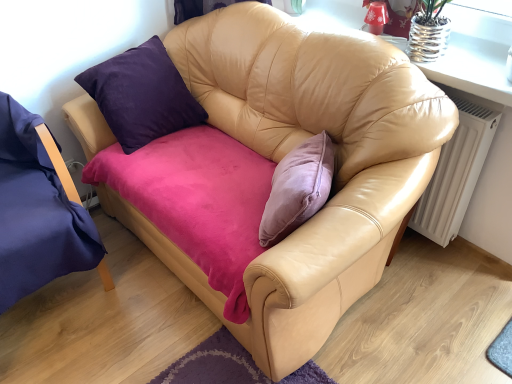
Find the location of a particular element. Image resolution: width=512 pixels, height=384 pixels. white matte radiator at right is located at coordinates (456, 169).

The height and width of the screenshot is (384, 512). What do you see at coordinates (456, 169) in the screenshot?
I see `white matte radiator at right` at bounding box center [456, 169].

What do you see at coordinates (39, 210) in the screenshot? I see `purple fabric chair at left` at bounding box center [39, 210].

Image resolution: width=512 pixels, height=384 pixels. What are the coordinates of `purple fabric chair at left` in the screenshot? It's located at (39, 210).

I want to click on white matte radiator at right, so click(x=456, y=169).

Is purple fabric chair at left at the right side of white matte radiator at right?

No, purple fabric chair at left is not to the right of white matte radiator at right.

Is purple fabric chair at left in front of white matte radiator at right?

That is True.

Which point is more distant from viewer, [34,134] or [492,121]?

The point [34,134] is farther from the camera.

From the image's perspective, which one is positioned higher, purple fabric chair at left or white matte radiator at right?

white matte radiator at right.

From a real-world perspective, is purple fabric chair at left beneath white matte radiator at right?

No.

Which of these two, purple fabric chair at left or white matte radiator at right, is thinner?

With smaller width is white matte radiator at right.

Which of these two, purple fabric chair at left or white matte radiator at right, stands shorter?

With less height is white matte radiator at right.

Can you confirm if purple fabric chair at left is bigger than white matte radiator at right?

Indeed, purple fabric chair at left has a larger size compared to white matte radiator at right.

Is purple fabric chair at left completely or partially outside of white matte radiator at right?

Indeed, purple fabric chair at left is completely outside white matte radiator at right.

Is purple fabric chair at left far away from white matte radiator at right?

Yes.

Is purple fabric chair at left looking in the opposite direction of white matte radiator at right?

No, purple fabric chair at left is not facing away from white matte radiator at right.

How many degrees apart are the facing directions of purple fabric chair at left and white matte radiator at right?

83.6 degrees.

Identify the location of chair that is above the white matte radiator at right (from a real-world perspective). The height and width of the screenshot is (384, 512). point(39,210).

Considering the positions of objects white matte radiator at right and purple fabric chair at left in the image provided, who is more to the right, white matte radiator at right or purple fabric chair at left?

From the viewer's perspective, white matte radiator at right appears more on the right side.

Is white matte radiator at right further to the viewer compared to purple fabric chair at left?

Yes.

Considering the positions of point (473, 125) and point (3, 307), is point (473, 125) closer or farther from the camera than point (3, 307)?

Clearly, point (473, 125) is more distant from the camera than point (3, 307).

From the image's perspective, is white matte radiator at right positioned above or below purple fabric chair at left?

Based on their image positions, white matte radiator at right is located above purple fabric chair at left.

From a real-world perspective, relative to purple fabric chair at left, is white matte radiator at right vertically above or below?

From a real-world perspective, white matte radiator at right is physically below purple fabric chair at left.

Which object is thinner, white matte radiator at right or purple fabric chair at left?

With smaller width is white matte radiator at right.

Considering the relative sizes of white matte radiator at right and purple fabric chair at left in the image provided, is white matte radiator at right shorter than purple fabric chair at left?

Yes, white matte radiator at right is shorter than purple fabric chair at left.

Who is bigger, white matte radiator at right or purple fabric chair at left?

Bigger between the two is purple fabric chair at left.

Is white matte radiator at right located outside purple fabric chair at left?

Yes, white matte radiator at right is not within purple fabric chair at left.

Is white matte radiator at right far from purple fabric chair at left?

Yes, white matte radiator at right is far from purple fabric chair at left.

Is white matte radiator at right facing towards purple fabric chair at left?

No, white matte radiator at right is not oriented towards purple fabric chair at left.

There is a white matte radiator at right. Where is `chair above it (from a real-world perspective)`? chair above it (from a real-world perspective) is located at coordinates (39, 210).

What are the coordinates of `radiator directly beneath the purple fabric chair at left (from a real-world perspective)` in the screenshot? It's located at point(456,169).

Where is `chair above the white matte radiator at right (from a real-world perspective)`? chair above the white matte radiator at right (from a real-world perspective) is located at coordinates (39, 210).